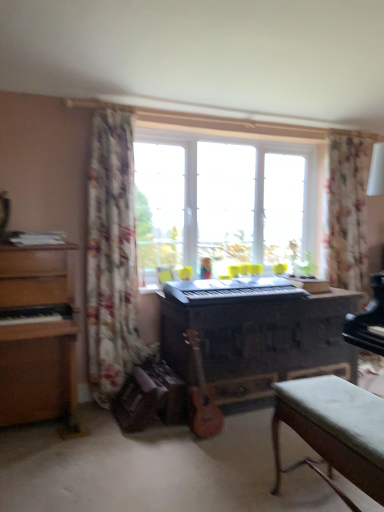
Locate an element on the screen. Image resolution: width=384 pixels, height=512 pixels. wooden piano at center is located at coordinates (256, 333).

Image resolution: width=384 pixels, height=512 pixels. I want to click on black plastic keyboard at center, so click(x=230, y=290).

Where is `transparent glass window at center`? The width and height of the screenshot is (384, 512). transparent glass window at center is located at coordinates click(x=225, y=202).

Image resolution: width=384 pixels, height=512 pixels. I want to click on wooden acoustic guitar at center, so click(201, 397).

How much space does floral fabric curtain at left, which appears as the 2th curtain when viewed from the back, occupy vertically?

floral fabric curtain at left, which appears as the 2th curtain when viewed from the back, is 6.50 feet tall.

Identify the location of wooden piano at center. The width and height of the screenshot is (384, 512). (256, 333).

Looking at this image, from the image's perspective, would you say black plastic keyboard at center is positioned over wooden chest of drawers at left?

Indeed, from the image's perspective, black plastic keyboard at center is shown above wooden chest of drawers at left.

Would you say wooden chest of drawers at left is part of black plastic keyboard at center's contents?

No, wooden chest of drawers at left is located outside of black plastic keyboard at center.

Is black plastic keyboard at center shorter than wooden chest of drawers at left?

Indeed, black plastic keyboard at center has a lesser height compared to wooden chest of drawers at left.

Is black plastic keyboard at center wider or thinner than wooden chest of drawers at left?

Considering their sizes, black plastic keyboard at center looks slimmer than wooden chest of drawers at left.

From the picture: Can you confirm if wooden piano at center is wider than wooden chest of drawers at left?

Incorrect, the width of wooden piano at center does not surpass that of wooden chest of drawers at left.

Is wooden piano at center aimed at wooden chest of drawers at left?

No.

Considering the sizes of objects wooden piano at center and wooden chest of drawers at left in the image provided, who is bigger, wooden piano at center or wooden chest of drawers at left?

wooden piano at center.

Considering the sizes of black plastic keyboard at center and floral fabric curtain at upper right, which appears as the second curtain when viewed from the left, in the image, is black plastic keyboard at center bigger or smaller than floral fabric curtain at upper right, which appears as the second curtain when viewed from the left,?

black plastic keyboard at center is smaller than floral fabric curtain at upper right, which appears as the second curtain when viewed from the left.

From the image's perspective, is black plastic keyboard at center positioned above or below floral fabric curtain at upper right, which appears as the second curtain when viewed from the left?

Clearly, from the image's perspective, black plastic keyboard at center is below floral fabric curtain at upper right, which appears as the second curtain when viewed from the left.

Relative to floral fabric curtain at upper right, which appears as the first curtain when viewed from the back, is black plastic keyboard at center in front or behind?

Clearly, black plastic keyboard at center is in front of floral fabric curtain at upper right, which appears as the first curtain when viewed from the back.

Is black plastic keyboard at center wider or thinner than floral fabric curtain at upper right, marked as the 2th curtain in a front-to-back arrangement?

Clearly, black plastic keyboard at center has less width compared to floral fabric curtain at upper right, marked as the 2th curtain in a front-to-back arrangement.

Could you tell me if wooden chest of drawers at left is turned towards green fabric bench at lower right?

No, wooden chest of drawers at left does not turn towards green fabric bench at lower right.

What's the angular difference between wooden chest of drawers at left and green fabric bench at lower right's facing directions?

They differ by 88.7 degrees in their facing directions.

Is point (53, 382) positioned in front of point (289, 388)?

No, it is not.

Is wooden chest of drawers at left wider or thinner than green fabric bench at lower right?

Clearly, wooden chest of drawers at left has more width compared to green fabric bench at lower right.

Between floral fabric curtain at upper right, marked as the 2th curtain in a front-to-back arrangement, and floral fabric curtain at left, which ranks as the first curtain in left-to-right order, which one has less height?

With less height is floral fabric curtain at upper right, marked as the 2th curtain in a front-to-back arrangement.

In the image, is floral fabric curtain at upper right, which appears as the second curtain when viewed from the left, on the left side or the right side of floral fabric curtain at left, which appears as the 2th curtain when viewed from the back?

From the image, it's evident that floral fabric curtain at upper right, which appears as the second curtain when viewed from the left, is to the right of floral fabric curtain at left, which appears as the 2th curtain when viewed from the back.

How many degrees apart are the facing directions of floral fabric curtain at upper right, acting as the first curtain starting from the right, and floral fabric curtain at left, which appears as the 2th curtain when viewed from the back?

The angle between the facing direction of floral fabric curtain at upper right, acting as the first curtain starting from the right, and the facing direction of floral fabric curtain at left, which appears as the 2th curtain when viewed from the back, is 2.97 degrees.

Consider the image. Considering the positions of objects transparent glass window at center and floral fabric curtain at upper right, acting as the first curtain starting from the right, in the image provided, who is more to the left, transparent glass window at center or floral fabric curtain at upper right, acting as the first curtain starting from the right,?

From the viewer's perspective, transparent glass window at center appears more on the left side.

Is transparent glass window at center aimed at floral fabric curtain at upper right, marked as the 2th curtain in a front-to-back arrangement?

Yes, transparent glass window at center faces towards floral fabric curtain at upper right, marked as the 2th curtain in a front-to-back arrangement.

Which point is more distant from viewer, (x=246, y=249) or (x=347, y=249)?

Point (x=246, y=249)

Between transparent glass window at center and floral fabric curtain at upper right, marked as the 2th curtain in a front-to-back arrangement, which one has smaller size?

floral fabric curtain at upper right, marked as the 2th curtain in a front-to-back arrangement, is smaller.

Considering the positions of objects black plastic keyboard at center and wooden piano at center in the image provided, who is in front, black plastic keyboard at center or wooden piano at center?

black plastic keyboard at center.

Is black plastic keyboard at center inside the boundaries of wooden piano at center, or outside?

black plastic keyboard at center is outside wooden piano at center.

Image resolution: width=384 pixels, height=512 pixels. Identify the location of piano on the right side of black plastic keyboard at center. (256, 333).

From the image's perspective, between black plastic keyboard at center and wooden piano at center, which one is located above?

black plastic keyboard at center is shown above in the image.

In the image, there is a wooden chest of drawers at left. Where is `musical keyboard above it (from the image's perspective)`? The height and width of the screenshot is (512, 384). musical keyboard above it (from the image's perspective) is located at coordinates (230, 290).

You are a GUI agent. You are given a task and a screenshot of the screen. Output one action in this format:
    pyautogui.click(x=<x>, y=<y>)
    Task: Click on the chest of drawers in front of the wooden piano at center
    
    Given the screenshot: What is the action you would take?
    pyautogui.click(x=38, y=337)

Which object lies nearer to the anchor point transparent glass window at center, floral fabric curtain at left, which appears as the second curtain when viewed from the right, or floral fabric curtain at upper right, which appears as the second curtain when viewed from the left?

Among the two, floral fabric curtain at upper right, which appears as the second curtain when viewed from the left, is located nearer to transparent glass window at center.

From the image, which object appears to be farther from wooden chest of drawers at left, green fabric bench at lower right or transparent glass window at center?

transparent glass window at center is positioned further to the anchor wooden chest of drawers at left.

From the image, which object appears to be nearer to wooden chest of drawers at left, transparent glass window at center or wooden acoustic guitar at center?

Among the two, wooden acoustic guitar at center is located nearer to wooden chest of drawers at left.

Estimate the real-world distances between objects in this image. Which object is further from transparent glass window at center, wooden piano at center or floral fabric curtain at left, which appears as the second curtain when viewed from the right?

Among the two, floral fabric curtain at left, which appears as the second curtain when viewed from the right, is located further to transparent glass window at center.

When comparing their distances from floral fabric curtain at left, which appears as the second curtain when viewed from the right, does transparent glass window at center or floral fabric curtain at upper right, acting as the first curtain starting from the right, seem further?

floral fabric curtain at upper right, acting as the first curtain starting from the right, is further to floral fabric curtain at left, which appears as the second curtain when viewed from the right.

Considering their positions, is floral fabric curtain at left, which appears as the 2th curtain when viewed from the back, positioned further to wooden chest of drawers at left than black plastic keyboard at center?

Based on the image, black plastic keyboard at center appears to be further to wooden chest of drawers at left.

Looking at the image, which one is located further to wooden chest of drawers at left, floral fabric curtain at upper right, which appears as the second curtain when viewed from the left, or floral fabric curtain at left, which ranks as the first curtain in left-to-right order?

Among the two, floral fabric curtain at upper right, which appears as the second curtain when viewed from the left, is located further to wooden chest of drawers at left.

Looking at the image, which one is located further to floral fabric curtain at left, which appears as the first curtain when viewed from the front, wooden piano at center or wooden chest of drawers at left?

wooden piano at center is positioned further to the anchor floral fabric curtain at left, which appears as the first curtain when viewed from the front.

Image resolution: width=384 pixels, height=512 pixels. I want to click on window between wooden acoustic guitar at center and floral fabric curtain at upper right, which appears as the first curtain when viewed from the back, so click(225, 202).

In order to click on piano between black plastic keyboard at center and wooden acoustic guitar at center in the vertical direction in this screenshot , I will do `click(256, 333)`.

You are a GUI agent. You are given a task and a screenshot of the screen. Output one action in this format:
    pyautogui.click(x=<x>, y=<y>)
    Task: Click on the curtain between wooden chest of drawers at left and wooden acoustic guitar at center
    The width and height of the screenshot is (384, 512).
    Given the screenshot: What is the action you would take?
    pyautogui.click(x=112, y=257)

Locate an element on the screen. piano between floral fabric curtain at left, which appears as the 2th curtain when viewed from the back, and floral fabric curtain at upper right, which appears as the second curtain when viewed from the left is located at coordinates (256, 333).